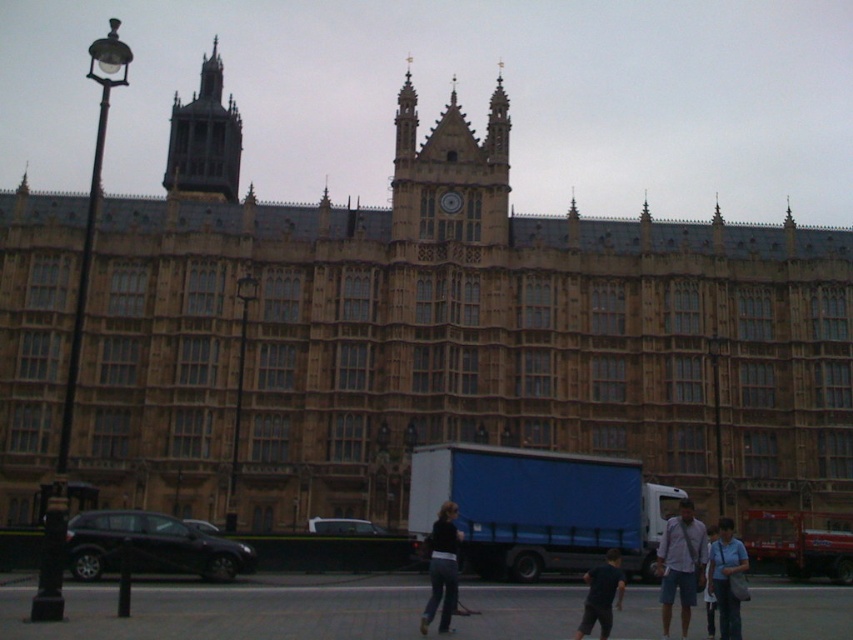
Looking at this image, you are a tourist standing on the street in front of the historic building. You notice the dark gray stone tower at upper left and the dark blue jeans at center. Which object appears bigger in the image?

The dark gray stone tower at upper left appears bigger than the dark blue jeans at center because it is larger in size according to the description.

You are a photographer standing in front of the historic Gothic building. You want to take a photo of the dark blue jeans at center and the dark blue shirt at center. Which one is closer to you?

The dark blue jeans at center are closer to you because the dark blue shirt at center is behind them.